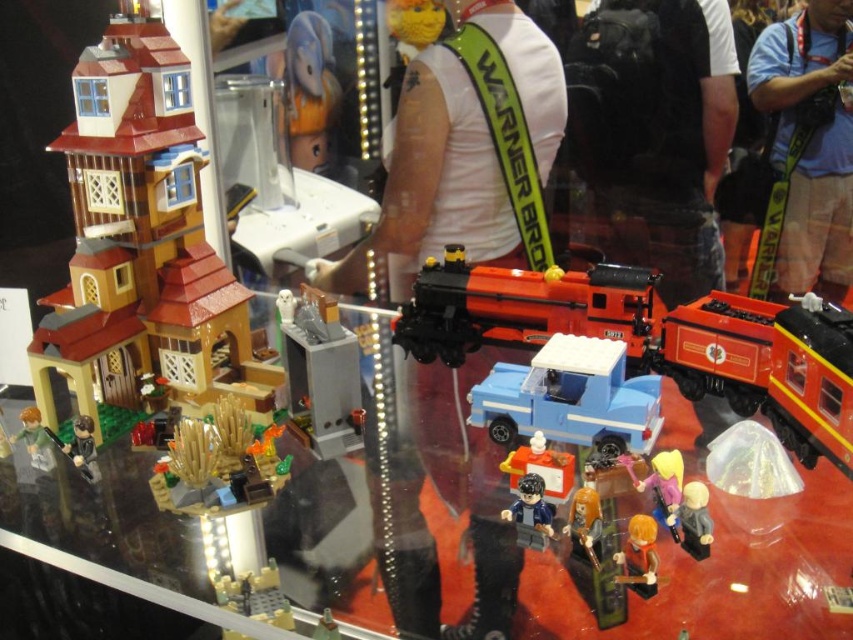
You are at the Lego display and want to find the orange plush duck at upper center. According to the display layout, where should you look relative to the multi story Lego house with red roof and brown walls?

The orange plush duck at upper center is located at point (310,90) relative to the multi story Lego house with red roof and brown walls, so you should look slightly to the left and above the house to find it.

You are a Lego enthusiast attending the convention and want to take a photo of the yellow plastic train at lower center and the pink matte figure at center. If you stand in front of the display, which object will appear to your left in the photo?

The yellow plastic train at lower center will appear to your left in the photo because it is positioned on the left side of the pink matte figure at center.

You are a Lego enthusiast standing in front of the display. You want to place a new Lego tree between the yellow plastic train at lower center and the pink matte figure at center. Based on their positions, where should the tree be placed?

The yellow plastic train at lower center is below the pink matte figure at center, so the tree should be placed between them vertically, positioning it above the train and below the figure.